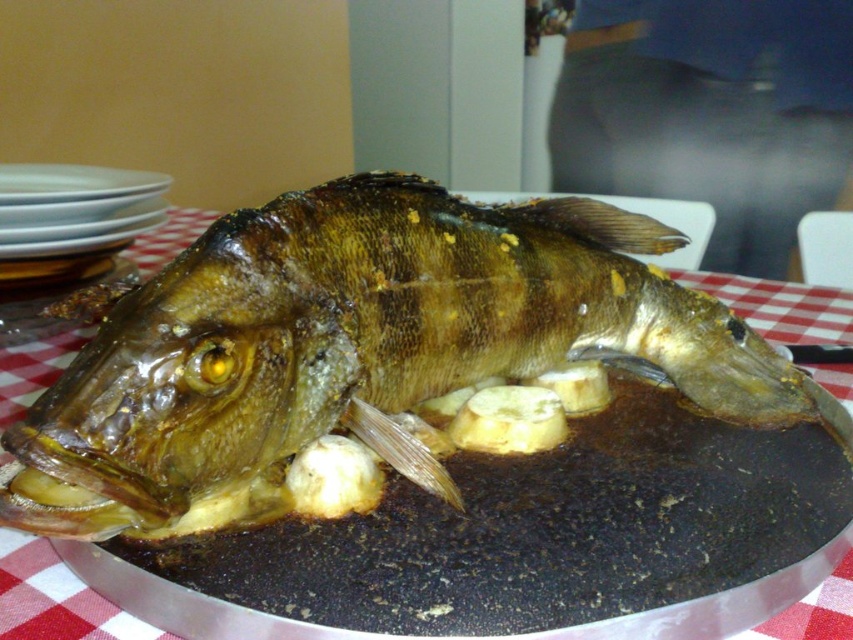
Question: Among these objects, which one is nearest to the camera?

Choices:
 (A) white glossy plate at upper left
 (B) shiny brown fish at center

Answer: (B)

Question: Is shiny brown fish at center wider than white glossy plate at upper left?

Choices:
 (A) yes
 (B) no

Answer: (A)

Question: Which point is closer to the camera taking this photo?

Choices:
 (A) (140, 189)
 (B) (173, 305)

Answer: (B)

Question: Is shiny brown fish at center positioned before white glossy plate at upper left?

Choices:
 (A) no
 (B) yes

Answer: (B)

Question: Is shiny brown fish at center above white glossy plate at upper left?

Choices:
 (A) yes
 (B) no

Answer: (B)